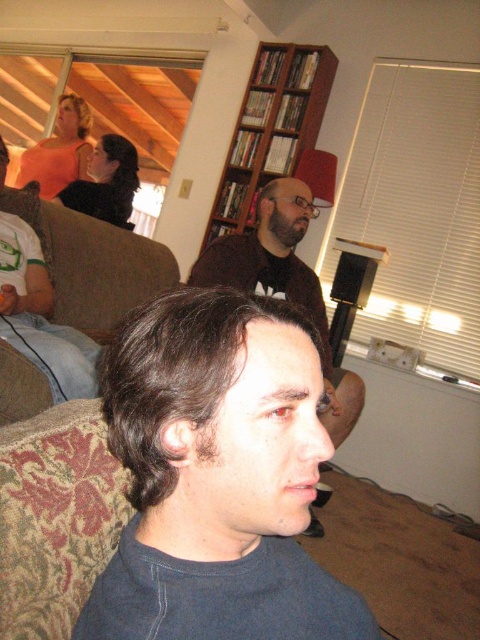
You are a photographer trying to capture a photo of the brown wooden bookshelf at upper center and the dark brown hair at center. Which object is taller in the image?

The brown wooden bookshelf at upper center is taller than the dark brown hair at center.

You are a photographer trying to capture a candid shot of the dark blue cotton shirt at center and the dark brown hair at center. Which object should you focus on first to ensure both are in sharp focus?

The dark blue cotton shirt at center is closer to the viewer than the dark brown hair at center, so you should focus on the dark brown hair at center first to ensure both are in sharp focus.

You are standing in the living room and want to place a small decorative item at the point with coordinates point (272, 128). According to the scene description, where exactly is this point located?

The point (272, 128) is on the brown wooden bookshelf at upper center.